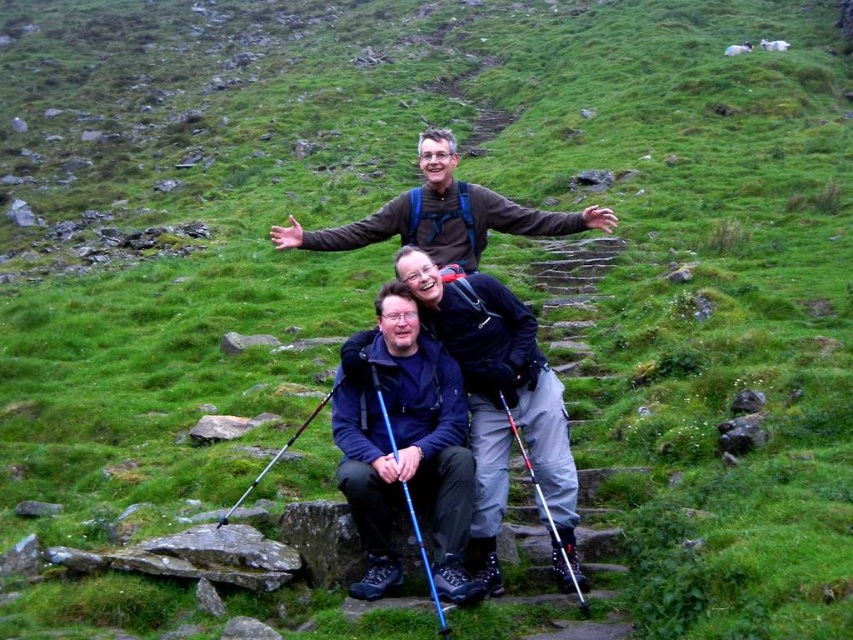
You are a drone operator trying to capture a photo of the dark blue fabric jacket at center. The drone is currently hovering at point 0.6, 0.6. Can you determine if the jacket is to the left or right of the drone?

The dark blue fabric jacket at center is located at point (502, 406). Since the drone is at (511, 384), the jacket is slightly to the right and below the drone.

You are a hiker who wants to take a photo of both the dark blue fabric jacket at center and the brown fabric jacket at center. Since you can only focus on one jacket at a time, which jacket should you focus on to ensure the other is still in the background?

You should focus on the dark blue fabric jacket at center because it is in front of the brown fabric jacket at center, so the brown fabric jacket at center will appear in the background when focused on the front jacket.

You are planning to take a photo of the three hikers on the grassy, rocky hillside. The dark blue fabric jacket at center is exactly at point (502, 406). If you want to ensure the dark blue fabric jacket at center is in the center of your photo, where should you position your camera relative to the hikers?

To center the dark blue fabric jacket at center, position your camera so that the jacket is exactly at the coordinates (502, 406) in the frame.